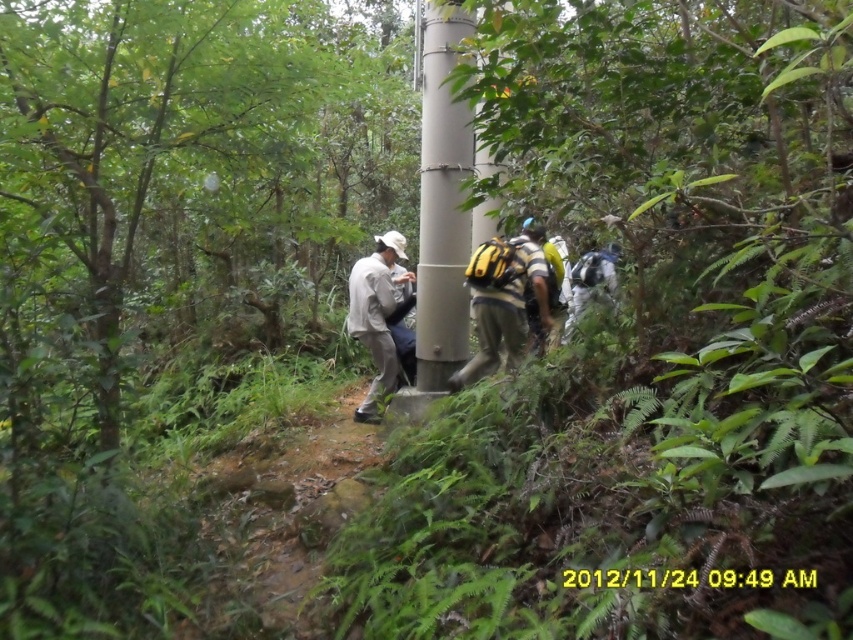
Is yellow fabric backpack at center to the right of white matte jacket at center from the viewer's perspective?

Indeed, yellow fabric backpack at center is positioned on the right side of white matte jacket at center.

Where is `yellow fabric backpack at center`? This screenshot has height=640, width=853. yellow fabric backpack at center is located at coordinates (503, 300).

Is point (440, 32) closer to viewer compared to point (527, 234)?

Yes, it is.

Identify the location of gray metallic pole at center. The height and width of the screenshot is (640, 853). (442, 204).

Is gray metallic pole at center thinner than white matte jacket at center?

Indeed, gray metallic pole at center has a lesser width compared to white matte jacket at center.

What do you see at coordinates (442, 204) in the screenshot?
I see `gray metallic pole at center` at bounding box center [442, 204].

The image size is (853, 640). Identify the location of gray metallic pole at center. (442, 204).